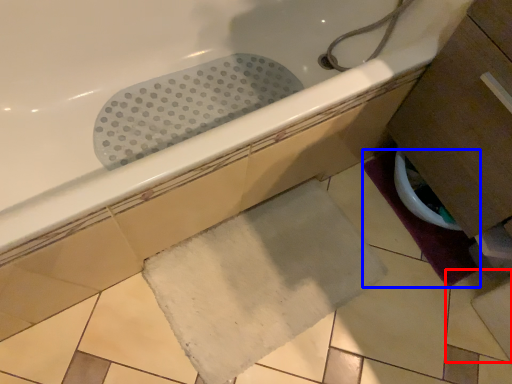
Question: Which object appears farthest to the camera in this image, ceramic tile (highlighted by a red box) or bath mat (highlighted by a blue box)?

Choices:
 (A) ceramic tile
 (B) bath mat

Answer: (B)